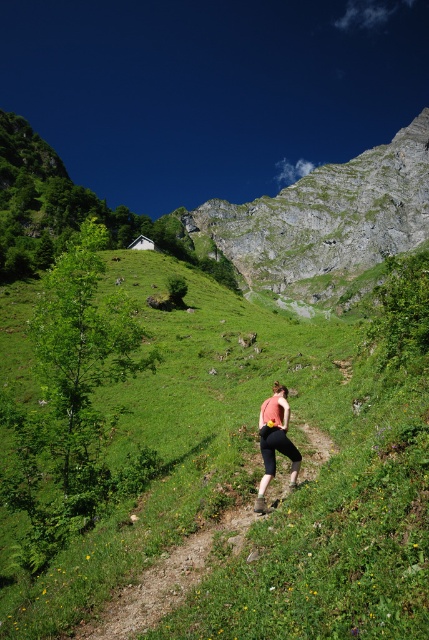
You are a hiker planning to reach the rugged stone mountain at upper center. You are currently standing at the base of the mountain, near the matte pink tank top at center. Which direction should you head to ascend the mountain?

The rugged stone mountain at upper center is located above the matte pink tank top at center, so you should head upwards from the matte pink tank top at center towards the rugged stone mountain at upper center.

You are a hiker planning to reach the rugged stone mountain at upper center from the brown dirt path at center. Based on the distance between them, can you estimate how long it would take to hike there if your average walking speed is 3 km per hour?

The rugged stone mountain at upper center and brown dirt path at center are 284.90 meters apart. At a walking speed of 3 km per hour, it would take approximately 5.7 minutes to hike there.